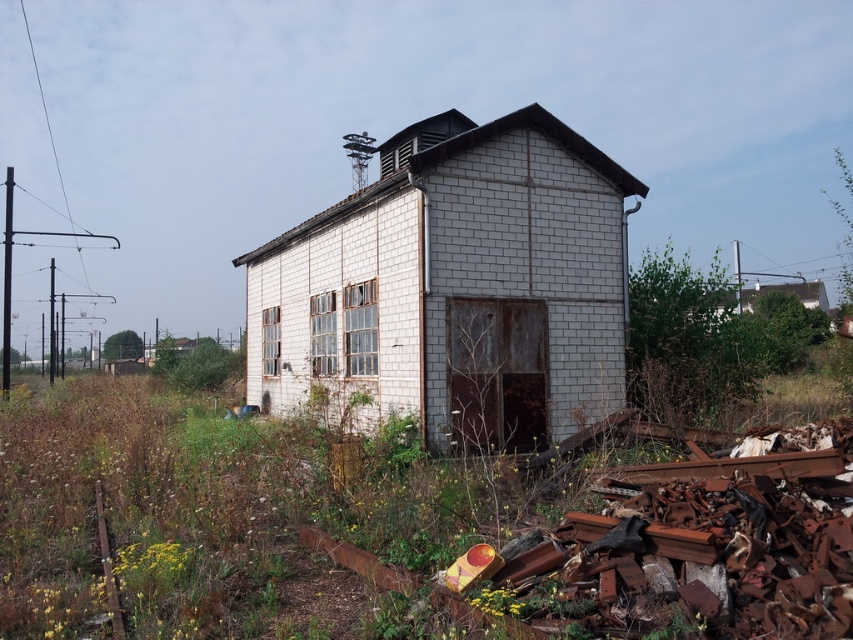
Question: Estimate the real-world distances between objects in this image. Which object is closer to the rusty metal train track at lower left?

Choices:
 (A) white brick building at center
 (B) white brick hut at upper right

Answer: (A)

Question: Can you confirm if white brick building at center is smaller than white brick hut at upper right?

Choices:
 (A) no
 (B) yes

Answer: (B)

Question: Is white brick building at center closer to the viewer compared to white brick hut at upper right?

Choices:
 (A) yes
 (B) no

Answer: (A)

Question: Which point is farther to the camera?

Choices:
 (A) [792, 288]
 (B) [265, 278]
 (C) [115, 616]

Answer: (A)

Question: Does white brick building at center appear on the left side of rusty metal train track at lower left?

Choices:
 (A) no
 (B) yes

Answer: (A)

Question: Considering the real-world distances, which object is closest to the white brick building at center?

Choices:
 (A) rusty metal train track at lower left
 (B) white brick hut at upper right

Answer: (A)